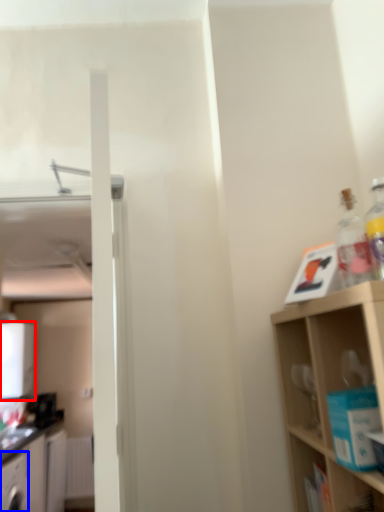
Question: Which object appears closest to the camera in this image, appliance (highlighted by a red box) or cabinetry (highlighted by a blue box)?

Choices:
 (A) appliance
 (B) cabinetry

Answer: (B)